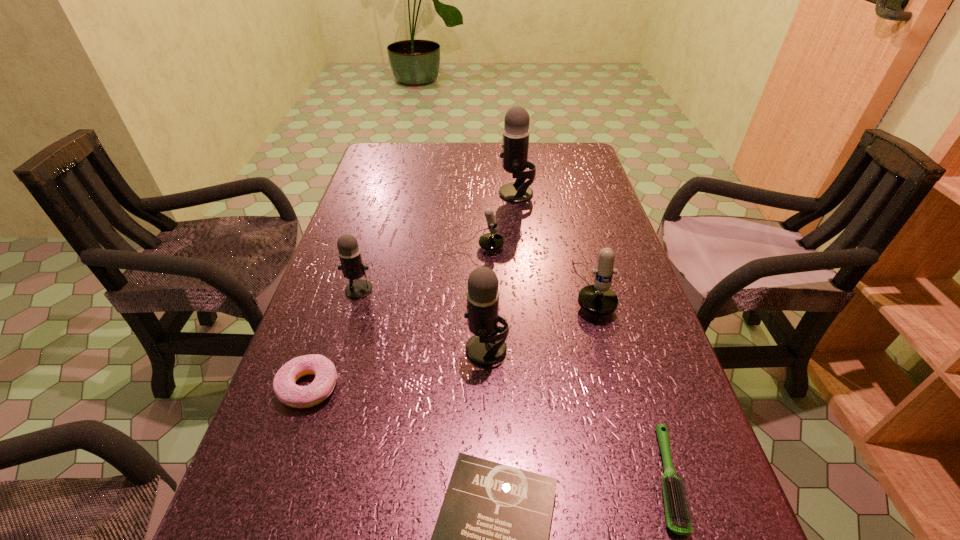
Image resolution: width=960 pixels, height=540 pixels. I want to click on pink doughnut, so click(287, 391).

The image size is (960, 540). In order to click on the sixth tallest object in this screenshot , I will do `click(287, 391)`.

Identify the location of hairbrush. (678, 520).

Image resolution: width=960 pixels, height=540 pixels. In order to click on vacant space situated 0.180m on the back of the rightmost gray microphone in this screenshot , I will do `click(512, 158)`.

At what (x,y) coordinates should I click in order to perform the action: click on free space located 0.150m on the front of the nearest microphone. Please return your answer as a coordinate pair (x, y). The width and height of the screenshot is (960, 540). Looking at the image, I should click on coord(488,439).

Find the location of a particular element. vacant area located 0.210m on the left of the bigger white microphone is located at coordinates (483, 289).

At what (x,y) coordinates should I click in order to perform the action: click on vacant space located on the back of the second farthest gray microphone. Please return your answer as a coordinate pair (x, y). The image size is (960, 540). Looking at the image, I should click on (369, 259).

Where is `free space located on the right of the second farthest object`? This screenshot has width=960, height=540. free space located on the right of the second farthest object is located at coordinates (613, 248).

Find the location of `vacant space situated on the right of the third shortest object`. vacant space situated on the right of the third shortest object is located at coordinates (512, 387).

The width and height of the screenshot is (960, 540). What are the coordinates of `vacant space situated 0.360m on the back of the hairbrush` in the screenshot? It's located at click(x=608, y=289).